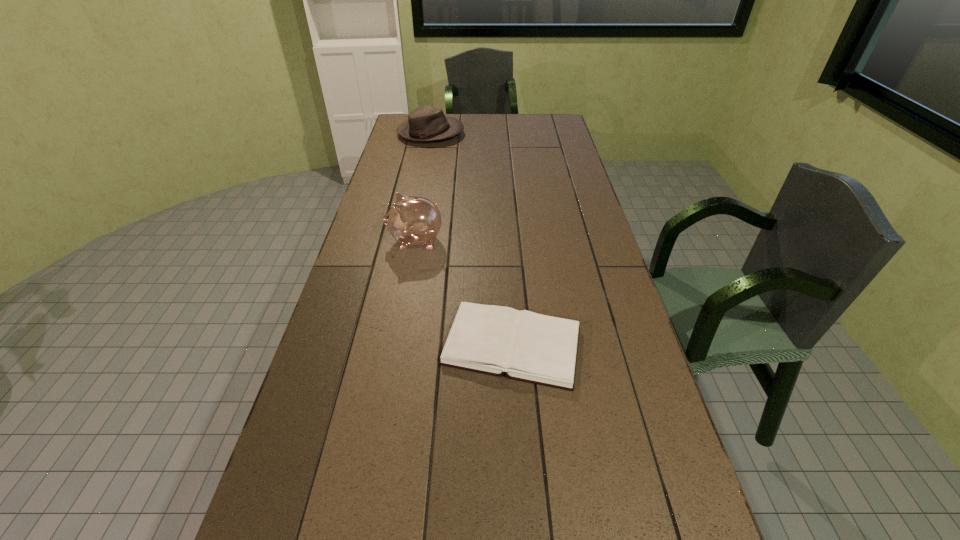
Where is `empty space that is in between the shortest object and the tallest object`? empty space that is in between the shortest object and the tallest object is located at coordinates (464, 293).

Find the location of a particular element. The width and height of the screenshot is (960, 540). free space between the shortest object and the tallest object is located at coordinates (464, 293).

This screenshot has height=540, width=960. Find the location of `vacant space that is in between the tallest object and the farthest object`. vacant space that is in between the tallest object and the farthest object is located at coordinates (423, 187).

Locate an element on the screen. The width and height of the screenshot is (960, 540). vacant area that lies between the tallest object and the nearest object is located at coordinates (464, 293).

This screenshot has width=960, height=540. I want to click on vacant point located between the tallest object and the second shortest object, so click(x=423, y=187).

Locate an element on the screen. This screenshot has width=960, height=540. empty space that is in between the second farthest object and the hardback book is located at coordinates (464, 293).

Locate which object ranks second in proximity to the second farthest object. Please provide its 2D coordinates. Your answer should be formatted as a tuple, i.e. [(x, y)], where the tuple contains the x and y coordinates of a point satisfying the conditions above.

[(426, 123)]

Locate which object is the second closest to the shortest object. Please provide its 2D coordinates. Your answer should be formatted as a tuple, i.e. [(x, y)], where the tuple contains the x and y coordinates of a point satisfying the conditions above.

[(426, 123)]

Identify the location of free region that satisfies the following two spatial constraints: 1. on the decorative side of the second shortest object; 2. on the back side of the hardback book. point(390,346).

Find the location of `vacant space that satisfies the following two spatial constraints: 1. on the front facing side of the hardback book; 2. on the left side of the piggy bank`. vacant space that satisfies the following two spatial constraints: 1. on the front facing side of the hardback book; 2. on the left side of the piggy bank is located at coordinates (396, 346).